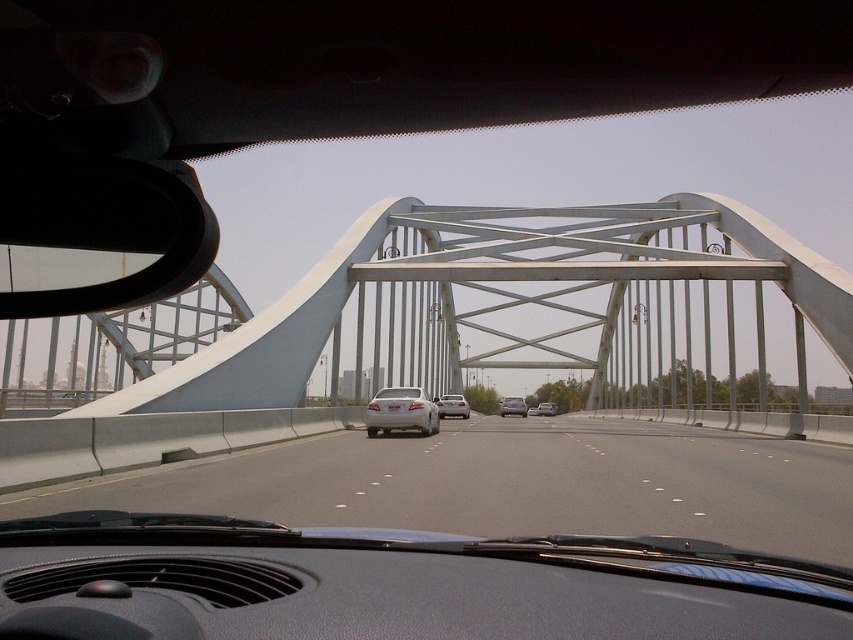
Can you confirm if white metallic bridge at center is positioned to the right of white glossy sedan at center?

No, white metallic bridge at center is not to the right of white glossy sedan at center.

Who is shorter, white metallic bridge at center or white glossy sedan at center?

With less height is white glossy sedan at center.

Between point (7, 339) and point (372, 436), which one is positioned in front?

Point (372, 436) is more forward.

The image size is (853, 640). In order to click on white metallic bridge at center in this screenshot , I will do `click(480, 316)`.

Who is more forward, (572,464) or (547,413)?

Point (572,464)

Can you confirm if gray asphalt highway at center is wider than silver metallic sedan at center?

Indeed, gray asphalt highway at center has a greater width compared to silver metallic sedan at center.

Image resolution: width=853 pixels, height=640 pixels. What do you see at coordinates (509, 483) in the screenshot? I see `gray asphalt highway at center` at bounding box center [509, 483].

I want to click on gray asphalt highway at center, so click(509, 483).

Can you confirm if white metallic bridge at center is shorter than white matte sedan at center?

No, white metallic bridge at center is not shorter than white matte sedan at center.

Can you confirm if white metallic bridge at center is taller than white matte sedan at center?

Yes, white metallic bridge at center is taller than white matte sedan at center.

You are a GUI agent. You are given a task and a screenshot of the screen. Output one action in this format:
    pyautogui.click(x=<x>, y=<y>)
    Task: Click on the white metallic bridge at center
    The width and height of the screenshot is (853, 640).
    Given the screenshot: What is the action you would take?
    [x=480, y=316]